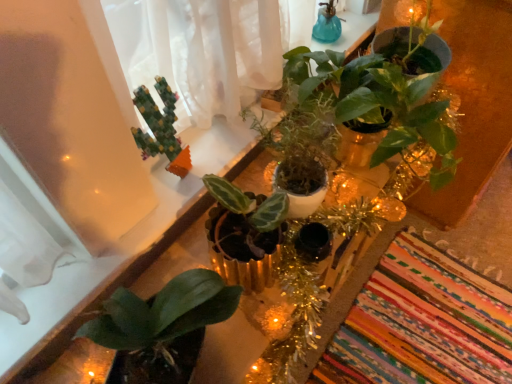
Question: From a real-world perspective, does green matte plant at upper center, placed as the 1th houseplant when sorted from right to left, stand above green mosaic cactus at upper left, positioned as the third houseplant in right-to-left order?

Choices:
 (A) no
 (B) yes

Answer: (A)

Question: Considering the relative sizes of green matte plant at upper center, the 3th houseplant in the left-to-right sequence, and green mosaic cactus at upper left, placed as the first houseplant when sorted from left to right, in the image provided, is green matte plant at upper center, the 3th houseplant in the left-to-right sequence, wider than green mosaic cactus at upper left, placed as the first houseplant when sorted from left to right,?

Choices:
 (A) no
 (B) yes

Answer: (B)

Question: Is green matte plant at upper center, the 3th houseplant in the left-to-right sequence, next to green mosaic cactus at upper left, placed as the first houseplant when sorted from left to right?

Choices:
 (A) yes
 (B) no

Answer: (B)

Question: From the image's perspective, would you say green matte plant at upper center, placed as the 1th houseplant when sorted from right to left, is positioned over green mosaic cactus at upper left, positioned as the third houseplant in right-to-left order?

Choices:
 (A) no
 (B) yes

Answer: (B)

Question: Would you say green matte plant at upper center, placed as the 1th houseplant when sorted from right to left, contains green mosaic cactus at upper left, placed as the first houseplant when sorted from left to right?

Choices:
 (A) yes
 (B) no

Answer: (B)

Question: Is green matte plant at upper center, the 3th houseplant in the left-to-right sequence, closer to the viewer compared to green mosaic cactus at upper left, placed as the first houseplant when sorted from left to right?

Choices:
 (A) yes
 (B) no

Answer: (A)

Question: Can you confirm if blue glass vase at upper center is smaller than green matte plant at center?

Choices:
 (A) no
 (B) yes

Answer: (B)

Question: Does blue glass vase at upper center come in front of green matte plant at center?

Choices:
 (A) no
 (B) yes

Answer: (A)

Question: Considering the relative sizes of blue glass vase at upper center and green matte plant at center in the image provided, is blue glass vase at upper center taller than green matte plant at center?

Choices:
 (A) no
 (B) yes

Answer: (A)

Question: From the image's perspective, does blue glass vase at upper center appear lower than green matte plant at center?

Choices:
 (A) yes
 (B) no

Answer: (B)

Question: Is blue glass vase at upper center further to camera compared to green matte plant at center?

Choices:
 (A) no
 (B) yes

Answer: (B)

Question: From a real-world perspective, is blue glass vase at upper center physically above green matte plant at center?

Choices:
 (A) no
 (B) yes

Answer: (B)

Question: Could you tell me if green matte plant at upper center, placed as the 1th houseplant when sorted from right to left, is facing multicolored woven mat at lower right?

Choices:
 (A) no
 (B) yes

Answer: (A)